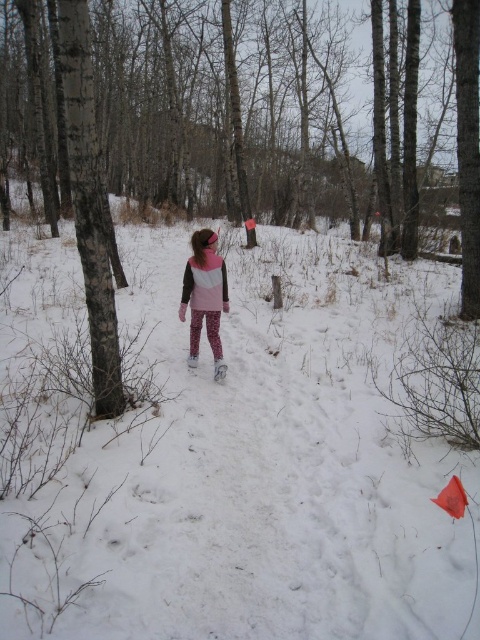
Between white fluffy snow at center and pink matte jacket at center, which one is positioned lower?

white fluffy snow at center is below.

Is point (152, 525) positioned in front of point (211, 268)?

That is True.

Does point (420, 576) lie behind point (219, 353)?

No, (420, 576) is in front of (219, 353).

Locate an element on the screen. The image size is (480, 640). white fluffy snow at center is located at coordinates (224, 452).

Can you confirm if white fluffy snow at center is positioned to the left of brown bark tree at center?

In fact, white fluffy snow at center is to the right of brown bark tree at center.

Between white fluffy snow at center and brown bark tree at center, which one appears on the left side from the viewer's perspective?

From the viewer's perspective, brown bark tree at center appears more on the left side.

Does point (120, 339) come in front of point (182, 6)?

Yes.

In order to click on white fluffy snow at center in this screenshot , I will do `click(224, 452)`.

Who is taller, brown bark tree at center or pink matte jacket at center?

brown bark tree at center

Can you confirm if brown bark tree at center is thinner than pink matte jacket at center?

In fact, brown bark tree at center might be wider than pink matte jacket at center.

Which is in front, point (216, 26) or point (215, 340)?

Point (215, 340) is in front.

The height and width of the screenshot is (640, 480). I want to click on brown bark tree at center, so click(222, 108).